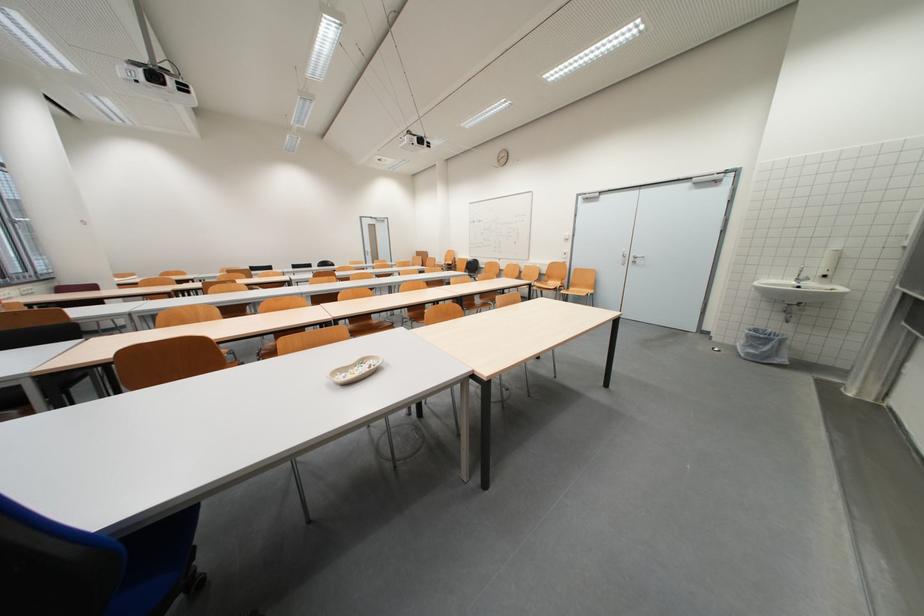
Image resolution: width=924 pixels, height=616 pixels. Describe the element at coordinates (823, 274) in the screenshot. I see `the soap dispenser button` at that location.